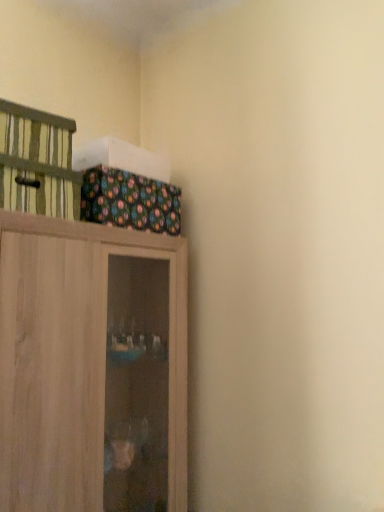
Question: From a real-world perspective, does wooden cupboard at upper left sit lower than green striped cabinet at upper left?

Choices:
 (A) no
 (B) yes

Answer: (B)

Question: Is wooden cupboard at upper left far from green striped cabinet at upper left?

Choices:
 (A) yes
 (B) no

Answer: (B)

Question: Is green striped cabinet at upper left at the back of wooden cupboard at upper left?

Choices:
 (A) yes
 (B) no

Answer: (B)

Question: Does wooden cupboard at upper left contain green striped cabinet at upper left?

Choices:
 (A) yes
 (B) no

Answer: (B)

Question: Considering the relative sizes of wooden cupboard at upper left and green striped cabinet at upper left in the image provided, is wooden cupboard at upper left smaller than green striped cabinet at upper left?

Choices:
 (A) no
 (B) yes

Answer: (A)

Question: Does wooden cupboard at upper left have a larger size compared to green striped cabinet at upper left?

Choices:
 (A) no
 (B) yes

Answer: (B)

Question: From a real-world perspective, is green striped cabinet at upper left located higher than wooden cupboard at upper left?

Choices:
 (A) no
 (B) yes

Answer: (B)

Question: Is green striped cabinet at upper left facing towards wooden cupboard at upper left?

Choices:
 (A) no
 (B) yes

Answer: (A)

Question: Considering the relative sizes of green striped cabinet at upper left and wooden cupboard at upper left in the image provided, is green striped cabinet at upper left taller than wooden cupboard at upper left?

Choices:
 (A) no
 (B) yes

Answer: (A)

Question: Is green striped cabinet at upper left turned away from wooden cupboard at upper left?

Choices:
 (A) no
 (B) yes

Answer: (A)

Question: Considering the relative sizes of green striped cabinet at upper left and wooden cupboard at upper left in the image provided, is green striped cabinet at upper left wider than wooden cupboard at upper left?

Choices:
 (A) no
 (B) yes

Answer: (A)

Question: Is green striped cabinet at upper left not near wooden cupboard at upper left?

Choices:
 (A) no
 (B) yes

Answer: (A)

Question: From a real-world perspective, is wooden cupboard at upper left physically located above or below green striped cabinet at upper left?

Choices:
 (A) above
 (B) below

Answer: (B)